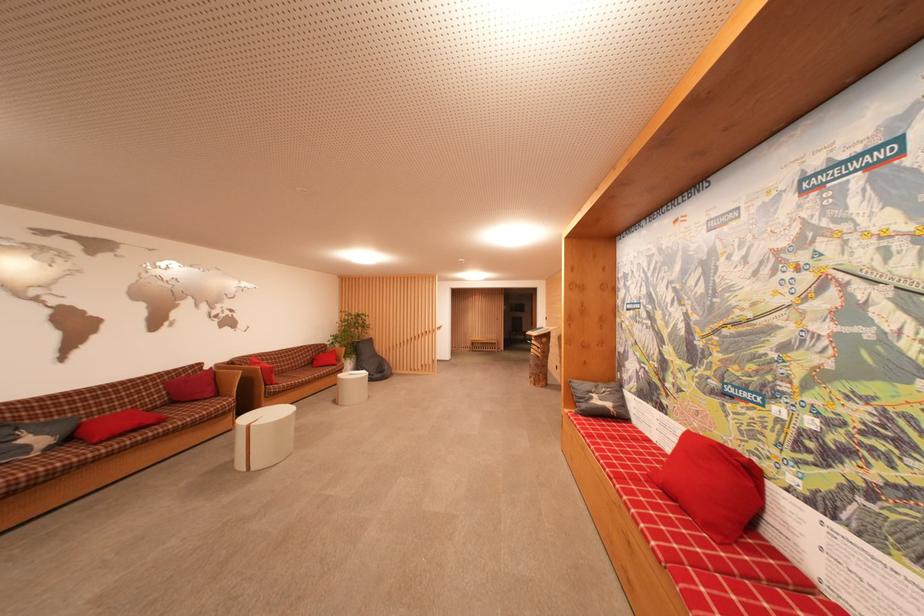
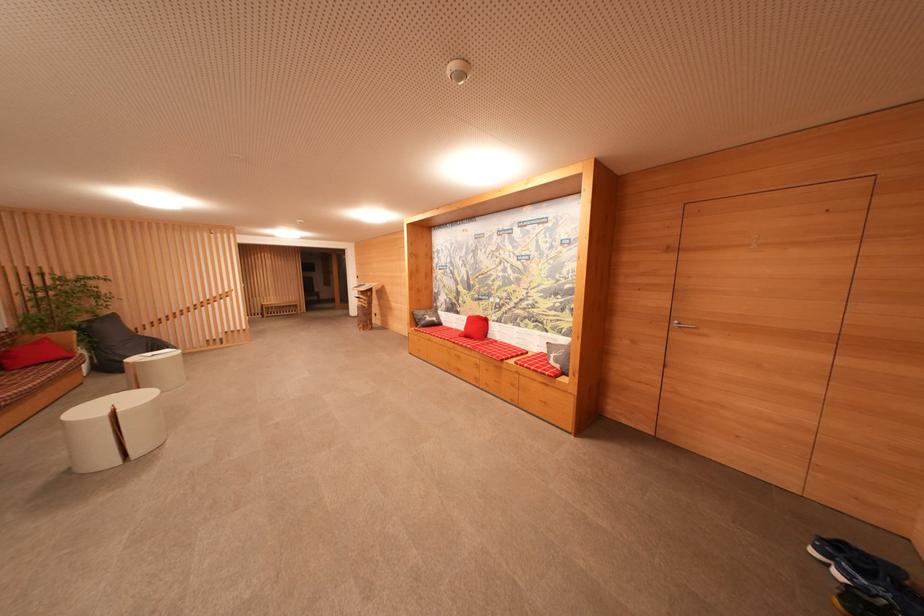
Locate, in the second image, the point that corresponds to [601,405] in the first image.

(432, 322)